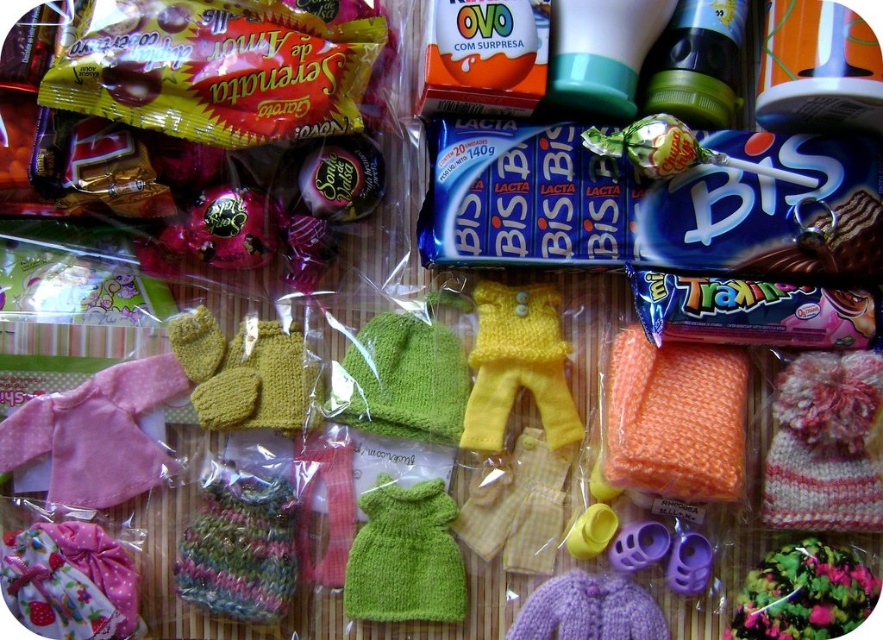
Question: Is fluffy fabric flower at center thinner than yellow knitted gloves at center?

Choices:
 (A) no
 (B) yes

Answer: (A)

Question: Which object appears farthest from the camera in this image?

Choices:
 (A) knitted pink hat at center right
 (B) shiny chocolate at center
 (C) green knitted dress at center
 (D) yellow knitted pants at center

Answer: (D)

Question: Which point is farther to the camera?

Choices:
 (A) tap(608, 596)
 (B) tap(457, 403)
 (C) tap(802, 554)
 (D) tap(552, 312)

Answer: (D)

Question: Considering the relative positions of knitted pink hat at center right and yellow knitted pants at center in the image provided, where is knitted pink hat at center right located with respect to yellow knitted pants at center?

Choices:
 (A) right
 (B) left

Answer: (A)

Question: Which point appears closest to the camera in this image?

Choices:
 (A) coord(655,385)
 (B) coord(389,576)

Answer: (A)

Question: Can you confirm if yellow knitted gloves at center is positioned to the right of purple knitted sweater at center?

Choices:
 (A) yes
 (B) no

Answer: (B)